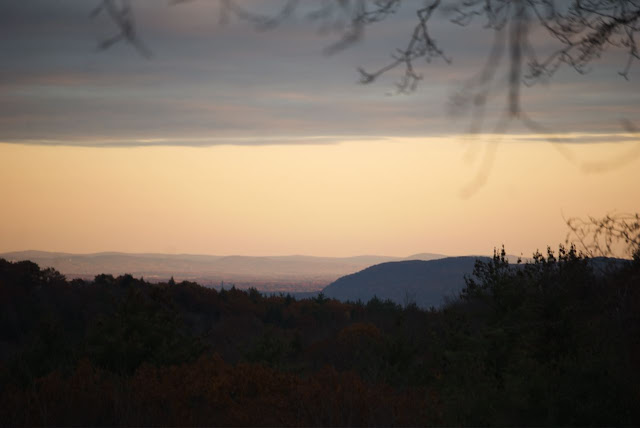
Locate an element on the screen. This screenshot has width=640, height=428. mesa is located at coordinates (299, 281).